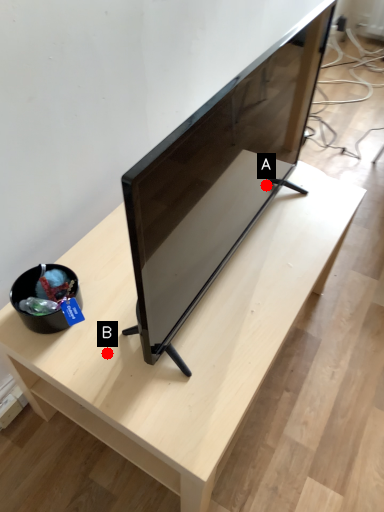
Question: Two points are circled on the image, labeled by A and B beside each circle. Which point appears closest to the camera in this image?

Choices:
 (A) A is closer
 (B) B is closer

Answer: (B)